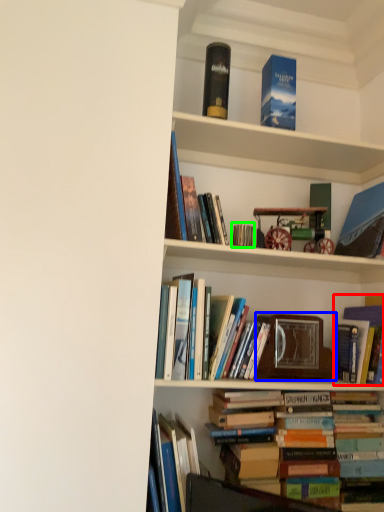
Question: Which is nearer to the book (highlighted by a red box)? picture frame (highlighted by a blue box) or book (highlighted by a green box).

Choices:
 (A) picture frame
 (B) book

Answer: (A)